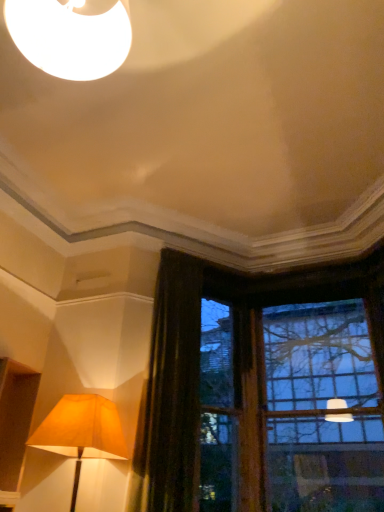
I want to click on matte gold lampshade at lower left, so click(x=82, y=432).

From a real-world perspective, is clear glass window at upper right positioned under dark brown velvet curtain at left based on gravity?

No, from a real-world perspective, clear glass window at upper right is not beneath dark brown velvet curtain at left.

Which object is thinner, clear glass window at upper right or dark brown velvet curtain at left?

dark brown velvet curtain at left is thinner.

Are clear glass window at upper right and dark brown velvet curtain at left making contact?

No, clear glass window at upper right is not with dark brown velvet curtain at left.

Find the location of a particular element. The image size is (384, 512). window behind the dark brown velvet curtain at left is located at coordinates (262, 391).

Are matte gold lampshade at lower left and clear glass window at upper right located far from each other?

Yes, matte gold lampshade at lower left and clear glass window at upper right are quite far apart.

Is point (78, 446) positioned behind point (218, 334)?

No, (78, 446) is closer to viewer.

Who is bigger, matte gold lampshade at lower left or clear glass window at upper right?

With larger size is clear glass window at upper right.

Can you confirm if matte gold lampshade at lower left is taller than clear glass window at upper right?

No.

From the picture: Is matte gold lampshade at lower left facing away from dark brown velvet curtain at left?

matte gold lampshade at lower left is not turned away from dark brown velvet curtain at left.

Is matte gold lampshade at lower left in contact with dark brown velvet curtain at left?

No, matte gold lampshade at lower left is not in contact with dark brown velvet curtain at left.

Considering the positions of point (109, 412) and point (166, 466), is point (109, 412) closer or farther from the camera than point (166, 466)?

Clearly, point (109, 412) is closer to the camera than point (166, 466).

Which of these two, matte gold lampshade at lower left or dark brown velvet curtain at left, is bigger?

With larger size is dark brown velvet curtain at left.

From the image's perspective, which object appears higher, dark brown velvet curtain at left or matte gold lampshade at lower left?

dark brown velvet curtain at left is shown above in the image.

Is point (173, 300) closer or farther from the camera than point (93, 453)?

Point (173, 300) is positioned farther from the camera compared to point (93, 453).

Is dark brown velvet curtain at left positioned far away from matte gold lampshade at lower left?

Actually, dark brown velvet curtain at left and matte gold lampshade at lower left are a little close together.

In terms of width, does dark brown velvet curtain at left look wider or thinner when compared to matte gold lampshade at lower left?

dark brown velvet curtain at left is thinner than matte gold lampshade at lower left.

Relative to clear glass window at upper right, is dark brown velvet curtain at left in front or behind?

Visually, dark brown velvet curtain at left is located in front of clear glass window at upper right.

Is clear glass window at upper right inside dark brown velvet curtain at left?

No, clear glass window at upper right is not surrounded by dark brown velvet curtain at left.

Is dark brown velvet curtain at left positioned far away from clear glass window at upper right?

They are positioned close to each other.

Would you say clear glass window at upper right is outside matte gold lampshade at lower left?

Absolutely, clear glass window at upper right is external to matte gold lampshade at lower left.

The width and height of the screenshot is (384, 512). I want to click on window lying behind the matte gold lampshade at lower left, so click(262, 391).

From the image's perspective, is clear glass window at upper right beneath matte gold lampshade at lower left?

Actually, clear glass window at upper right appears above matte gold lampshade at lower left in the image.

From the picture: Considering the sizes of objects clear glass window at upper right and matte gold lampshade at lower left in the image provided, who is thinner, clear glass window at upper right or matte gold lampshade at lower left?

Thinner between the two is clear glass window at upper right.

Identify the location of window behind the dark brown velvet curtain at left. The image size is (384, 512). point(262,391).

Locate an element on the screen. window positioned vertically above the matte gold lampshade at lower left (from a real-world perspective) is located at coordinates (262, 391).

Considering their positions, is matte gold lampshade at lower left positioned closer to dark brown velvet curtain at left than clear glass window at upper right?

The object closer to dark brown velvet curtain at left is clear glass window at upper right.

Considering their positions, is dark brown velvet curtain at left positioned closer to matte gold lampshade at lower left than clear glass window at upper right?

Based on the image, dark brown velvet curtain at left appears to be nearer to matte gold lampshade at lower left.

From the picture: Looking at the image, which one is located closer to clear glass window at upper right, matte gold lampshade at lower left or dark brown velvet curtain at left?

Based on the image, dark brown velvet curtain at left appears to be nearer to clear glass window at upper right.

Which object lies further to the anchor point dark brown velvet curtain at left, clear glass window at upper right or matte gold lampshade at lower left?

Based on the image, matte gold lampshade at lower left appears to be further to dark brown velvet curtain at left.

Estimate the real-world distances between objects in this image. Which object is closer to clear glass window at upper right, dark brown velvet curtain at left or matte gold lampshade at lower left?

dark brown velvet curtain at left is positioned closer to the anchor clear glass window at upper right.

From the picture: Looking at the image, which one is located closer to matte gold lampshade at lower left, clear glass window at upper right or dark brown velvet curtain at left?

dark brown velvet curtain at left.

You are a GUI agent. You are given a task and a screenshot of the screen. Output one action in this format:
    pyautogui.click(x=<x>, y=<y>)
    Task: Click on the curtain located between matte gold lampshade at lower left and clear glass window at upper right in the left-right direction
    The image size is (384, 512).
    Given the screenshot: What is the action you would take?
    pyautogui.click(x=170, y=394)